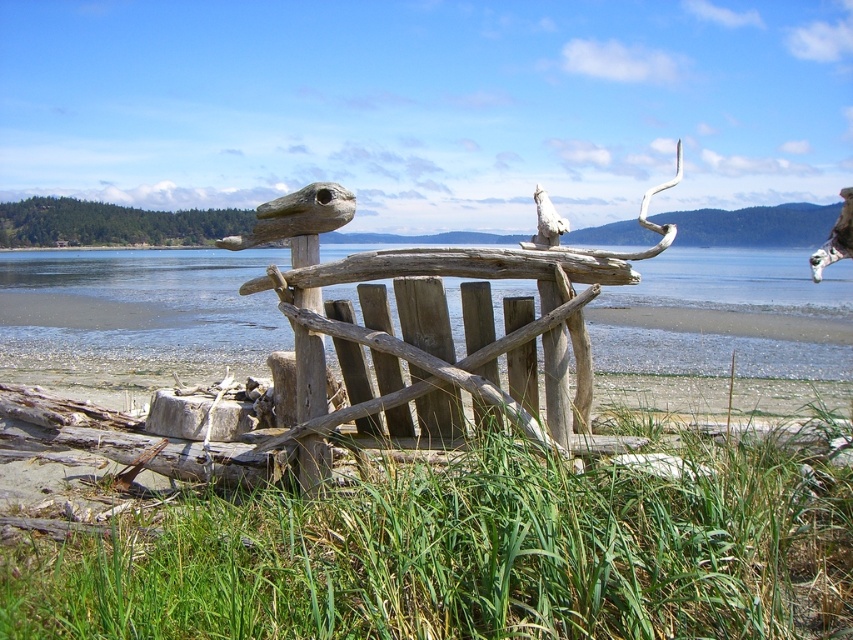
In the scene shown: You are a painter standing at the lakeside. You want to place your 1.5 meter long canvas between the brown wooden water at center and the carved wooden figure resembling a bird. Is there enough space?

The brown wooden water at center and the carved wooden figure resembling a bird are 3.50 meters apart. Since the canvas is only 1.5 meters long, there is sufficient space to place it between them.

You are a park ranger inspecting the lakeside area. You notice the brown wooden water at center and the driftwood bench at center. Which object is located above the other?

The brown wooden water at center is positioned over the driftwood bench at center.

You are standing at the center of the image and want to place a small decorative stone on the green grass at lower center. Given that the coordinate system starts at the bottom left corner of the image with coordinates 0.0,0.0 and extends to 1.0,1.0, what are the coordinates where you should place the stone?

The coordinates for the green grass at lower center are at point (474, 556), so you should place the stone there.